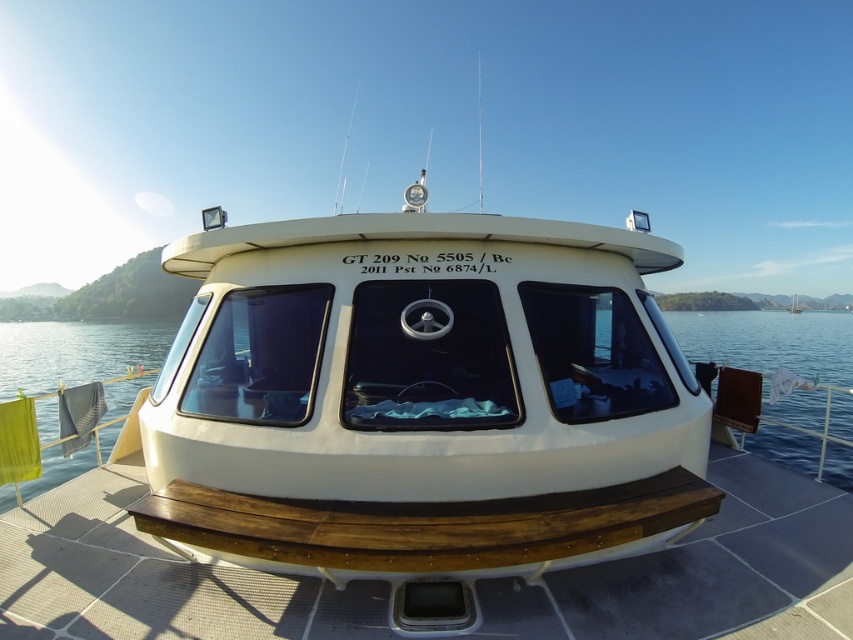
Question: Is brown wood at center positioned before transparent glass water at center?

Choices:
 (A) yes
 (B) no

Answer: (A)

Question: Does brown wood at center lie in front of transparent glass water at center?

Choices:
 (A) no
 (B) yes

Answer: (B)

Question: Is brown wood at center above transparent glass water at center?

Choices:
 (A) yes
 (B) no

Answer: (B)

Question: Which of the following is the closest to the observer?

Choices:
 (A) (144, 323)
 (B) (96, 490)

Answer: (B)

Question: Which object is closer to the camera taking this photo?

Choices:
 (A) brown wood at center
 (B) transparent glass water at center

Answer: (A)